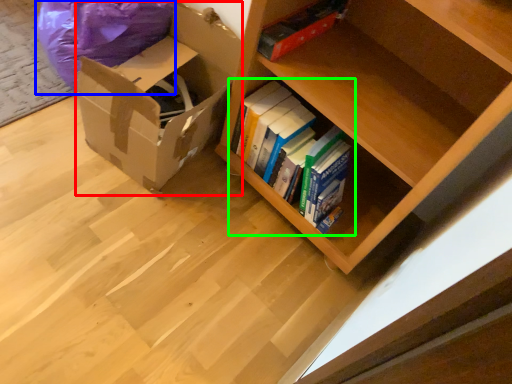
Question: Which object is the farthest from cardboard box (highlighted by a red box)? Choose among these: bean bag chair (highlighted by a blue box) or book (highlighted by a green box).

Choices:
 (A) bean bag chair
 (B) book

Answer: (B)